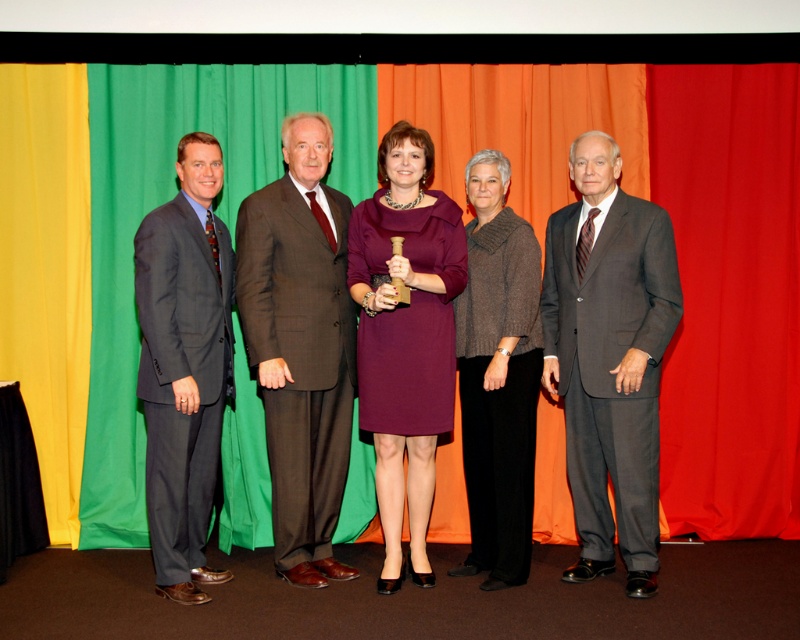
Who is taller, purple satin dress at center or brown woolen sweater at center?

purple satin dress at center

Is purple satin dress at center above brown woolen sweater at center?

Yes, purple satin dress at center is above brown woolen sweater at center.

Is point (396, 568) positioned before point (494, 205)?

Yes.

Locate an element on the screen. Image resolution: width=800 pixels, height=640 pixels. purple satin dress at center is located at coordinates (405, 337).

Can you confirm if dark gray suit at center is positioned to the left of brown wool suit at center?

In fact, dark gray suit at center is to the right of brown wool suit at center.

Between dark gray suit at center and brown wool suit at center, which one is positioned higher?

brown wool suit at center is above.

The image size is (800, 640). What are the coordinates of `dark gray suit at center` in the screenshot? It's located at (609, 356).

Does brown wool suit at center have a smaller size compared to purple satin dress at center?

Correct, brown wool suit at center occupies less space than purple satin dress at center.

Is the position of brown wool suit at center less distant than that of purple satin dress at center?

No, it is not.

Between point (300, 531) and point (397, 260), which one is positioned behind?

The point (300, 531) is behind.

You are a GUI agent. You are given a task and a screenshot of the screen. Output one action in this format:
    pyautogui.click(x=<x>, y=<y>)
    Task: Click on the brown wool suit at center
    
    Given the screenshot: What is the action you would take?
    pyautogui.click(x=300, y=346)